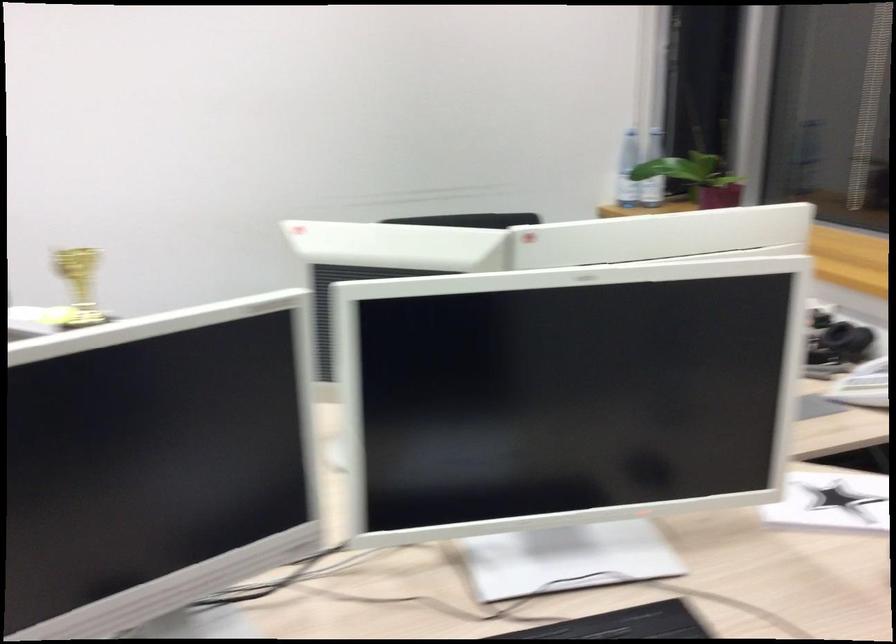
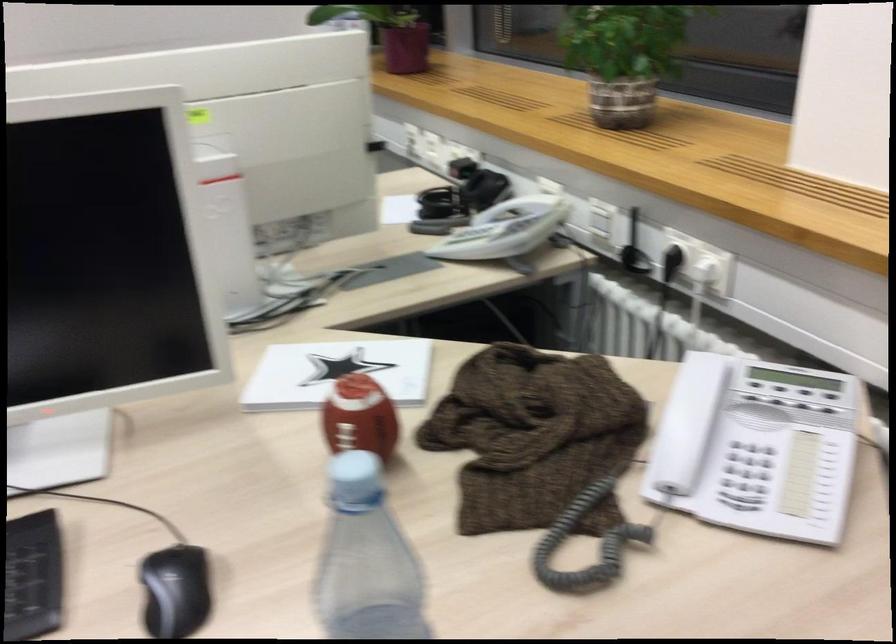
Question: Based on the continuous images, in which direction is the camera rotating? Reply with the corresponding letter.

Choices:
 (A) Left
 (B) Right
 (C) Up
 (D) Down

Answer: (D)